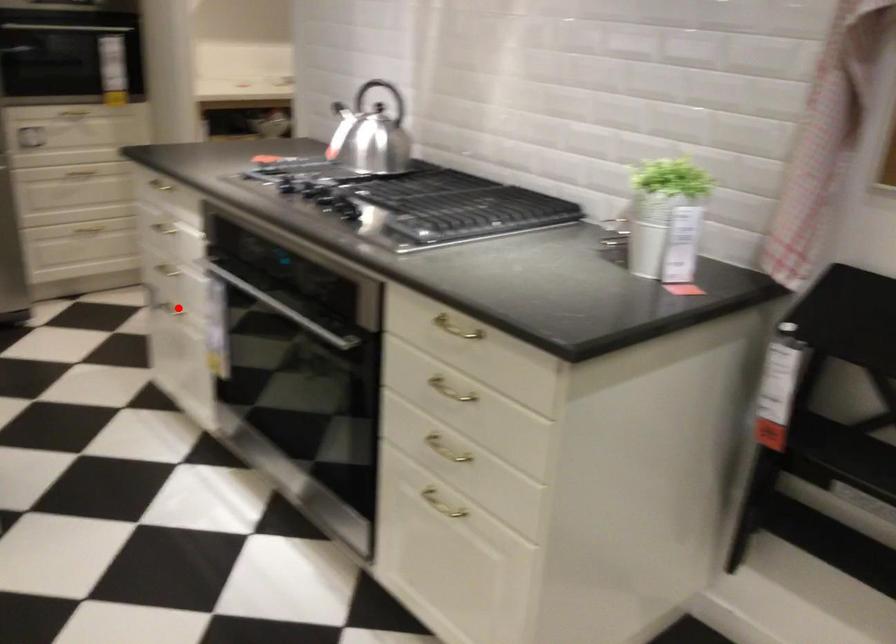
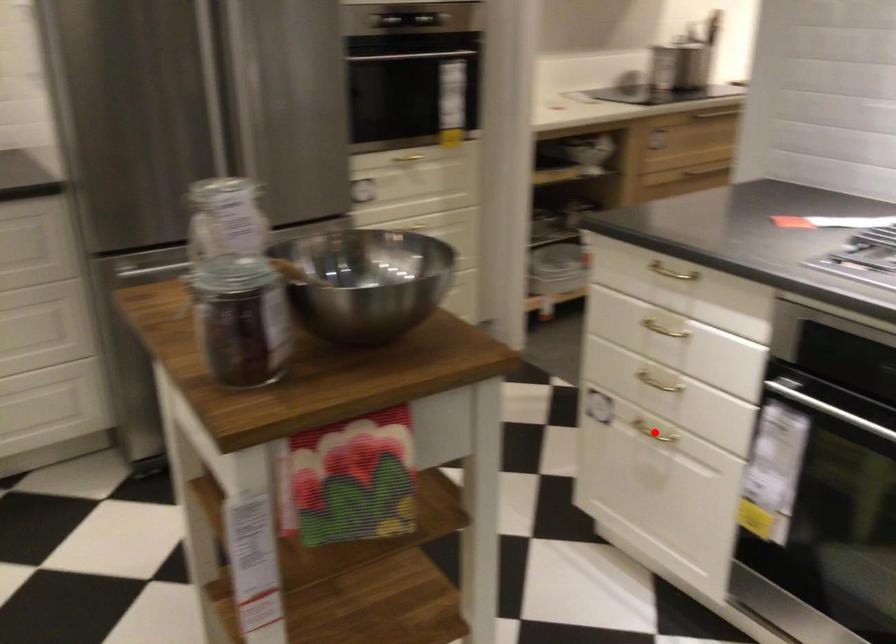
I am providing you with two images of the same scene from different viewpoints. A red point is marked on the first image and another point is marked on the second image. Is the red point in image1 aligned with the point shown in image2?

Yes